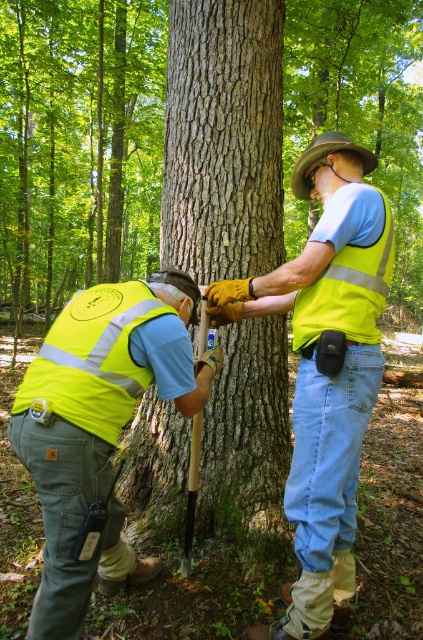
Looking at this image, does high visibility yellow vest at lower left appear on the left side of high visibility yellow safety vest at center?

No, high visibility yellow vest at lower left is not to the left of high visibility yellow safety vest at center.

Describe the element at coordinates (98, 426) in the screenshot. I see `high visibility yellow vest at lower left` at that location.

The height and width of the screenshot is (640, 423). What do you see at coordinates (98, 426) in the screenshot? I see `high visibility yellow vest at lower left` at bounding box center [98, 426].

Where is `high visibility yellow vest at lower left`? high visibility yellow vest at lower left is located at coordinates (98, 426).

Can you confirm if rough bark tree at center is shorter than high visibility yellow vest at lower left?

Incorrect, rough bark tree at center's height does not fall short of high visibility yellow vest at lower left's.

Does rough bark tree at center appear on the left side of high visibility yellow vest at lower left?

Yes, rough bark tree at center is to the left of high visibility yellow vest at lower left.

Does point (74, 193) come farther from viewer compared to point (181, 380)?

Yes, it is.

The width and height of the screenshot is (423, 640). What are the coordinates of `rough bark tree at center` in the screenshot? It's located at (77, 145).

Between point (337, 564) and point (373, 300), which one is positioned behind?

The point (337, 564) is more distant.

Is yellow reflective vest at center bigger than high-visibility yellow safety vest at upper right?

Correct, yellow reflective vest at center is larger in size than high-visibility yellow safety vest at upper right.

Which is in front, point (318, 566) or point (338, 330)?

Point (338, 330) is in front.

I want to click on yellow reflective vest at center, so click(326, 369).